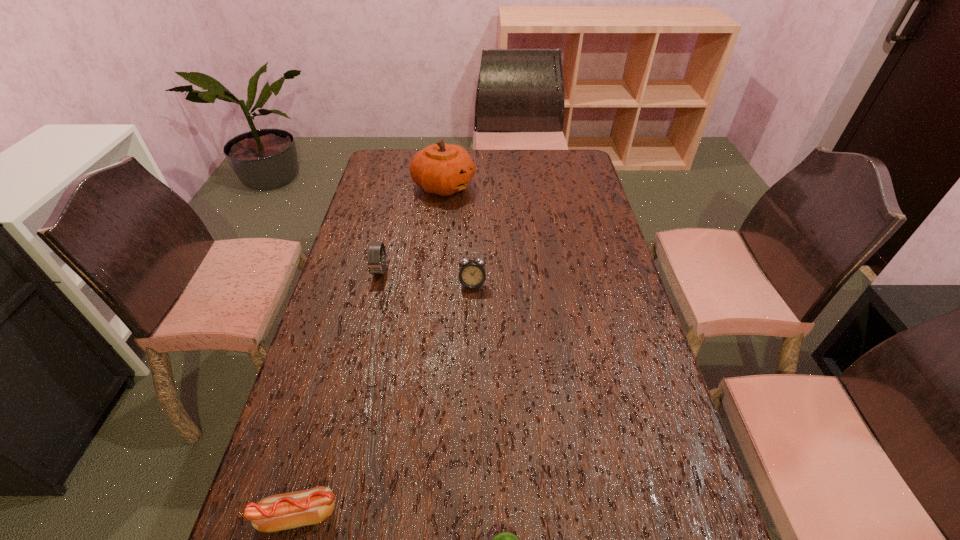
Identify the location of vacant area that lies between the pumpkin and the shortest object. This screenshot has width=960, height=540. (371, 350).

Locate an element on the screen. This screenshot has width=960, height=540. free point between the tallest object and the sausage is located at coordinates (371, 350).

This screenshot has width=960, height=540. In order to click on object that stands as the third closest to the avocado in this screenshot , I will do `click(375, 262)`.

Select which object appears as the fourth closest to the watch. Please provide its 2D coordinates. Your answer should be formatted as a tuple, i.e. [(x, y)], where the tuple contains the x and y coordinates of a point satisfying the conditions above.

[(505, 539)]

Locate an element on the screen. blank area in the image that satisfies the following two spatial constraints: 1. on the front-facing side of the pumpkin; 2. on the face of the watch is located at coordinates (434, 271).